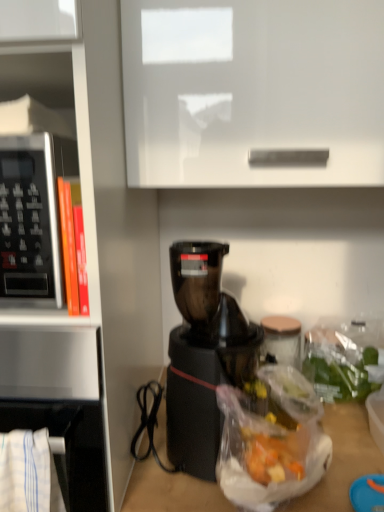
What do you see at coordinates (253, 93) in the screenshot?
I see `white glossy cabinet at upper center` at bounding box center [253, 93].

Describe the element at coordinates (339, 366) in the screenshot. I see `translucent plastic bag at lower right` at that location.

You are a GUI agent. You are given a task and a screenshot of the screen. Output one action in this format:
    pyautogui.click(x=<x>, y=<y>)
    Task: Click on the translucent plastic bag at lower right
    This screenshot has height=512, width=384.
    Given the screenshot: What is the action you would take?
    pyautogui.click(x=339, y=366)

Identify the location of black plastic microwave at left. This screenshot has width=384, height=512. (32, 216).

Locate an element on the screen. The width and height of the screenshot is (384, 512). white glossy cabinet at upper center is located at coordinates (253, 93).

Is black plastic microwave at left closer to the viewer compared to satin silver microwave at left?

No, black plastic microwave at left is behind satin silver microwave at left.

Does point (47, 226) come in front of point (45, 348)?

Yes, point (47, 226) is in front of point (45, 348).

Measure the distance from black plastic microwave at left to black plastic coffee maker at center.

They are 15.11 inches apart.

From the image's perspective, which one is positioned lower, black plastic microwave at left or black plastic coffee maker at center?

black plastic coffee maker at center appears lower in the image.

From a real-world perspective, between black plastic microwave at left and black plastic coffee maker at center, who is vertically higher?

black plastic microwave at left, from a real-world perspective.

Considering the sizes of black plastic microwave at left and black plastic coffee maker at center in the image, is black plastic microwave at left taller or shorter than black plastic coffee maker at center?

Considering their sizes, black plastic microwave at left has less height than black plastic coffee maker at center.

From a real-world perspective, is white glossy cabinet at upper center over translucent plastic bag at lower right?

Yes, from a real-world perspective, white glossy cabinet at upper center is over translucent plastic bag at lower right

Which of these two, white glossy cabinet at upper center or translucent plastic bag at lower right, is bigger?

With larger size is white glossy cabinet at upper center.

Is translucent plastic bag at lower right surrounded by white glossy cabinet at upper center?

No, white glossy cabinet at upper center does not contain translucent plastic bag at lower right.

Is white glossy cabinet at upper center oriented towards translucent plastic bag at lower right?

No, white glossy cabinet at upper center does not turn towards translucent plastic bag at lower right.

Considering the sizes of objects black plastic coffee maker at center and black plastic microwave at left in the image provided, who is taller, black plastic coffee maker at center or black plastic microwave at left?

With more height is black plastic coffee maker at center.

Choose the correct answer: Is black plastic coffee maker at center inside black plastic microwave at left or outside it?

black plastic coffee maker at center cannot be found inside black plastic microwave at left.

Is black plastic coffee maker at center turned away from black plastic microwave at left?

No.

Is black plastic coffee maker at center to the right of black plastic microwave at left from the viewer's perspective?

Yes.

How many degrees apart are the facing directions of translucent plastic bag at lower right and satin silver microwave at left?

translucent plastic bag at lower right and satin silver microwave at left are facing 1.12 degrees away from each other.

Between translucent plastic bag at lower right and satin silver microwave at left, which one is positioned behind?

translucent plastic bag at lower right is further away from the camera.

From a real-world perspective, relative to satin silver microwave at left, is translucent plastic bag at lower right vertically above or below?

translucent plastic bag at lower right is situated lower than satin silver microwave at left in the real world.

Choose the correct answer: Is translucent plastic bag at lower right inside satin silver microwave at left or outside it?

translucent plastic bag at lower right lies outside satin silver microwave at left.

Considering the positions of point (202, 365) and point (103, 252), is point (202, 365) closer or farther from the camera than point (103, 252)?

Point (202, 365) appears to be farther away from the viewer than point (103, 252).

Which object is positioned more to the right, black plastic coffee maker at center or satin silver microwave at left?

black plastic coffee maker at center.

Identify the location of bookshelf on the left of black plastic coffee maker at center. The height and width of the screenshot is (512, 384). (89, 269).

From a real-world perspective, relative to satin silver microwave at left, is black plastic coffee maker at center vertically above or below?

From a real-world perspective, black plastic coffee maker at center is physically below satin silver microwave at left.

Is the surface of black plastic microwave at left in direct contact with translucent plastic bag at lower right?

They are not placed beside each other.

Considering the relative sizes of black plastic microwave at left and translucent plastic bag at lower right in the image provided, is black plastic microwave at left shorter than translucent plastic bag at lower right?

No.

Is black plastic microwave at left bigger than translucent plastic bag at lower right?

Indeed, black plastic microwave at left has a larger size compared to translucent plastic bag at lower right.

Identify the location of microwave oven on the right of satin silver microwave at left. (32, 216).

At what (x,y) coordinates should I click in order to perform the action: click on coffee maker behind the black plastic microwave at left. Please return your answer as a coordinate pair (x, y). The image size is (384, 512). Looking at the image, I should click on (203, 355).

Estimate the real-world distances between objects in this image. Which object is further from black plastic microwave at left, black plastic coffee maker at center or satin silver microwave at left?

Based on the image, black plastic coffee maker at center appears to be further to black plastic microwave at left.

Based on their spatial positions, is translucent plastic bag at lower right or black plastic coffee maker at center closer to black plastic microwave at left?

The object closer to black plastic microwave at left is black plastic coffee maker at center.

Which object lies further to the anchor point satin silver microwave at left, black plastic coffee maker at center or black plastic microwave at left?

The object further to satin silver microwave at left is black plastic coffee maker at center.

Estimate the real-world distances between objects in this image. Which object is closer to white glossy cabinet at upper center, black plastic microwave at left or satin silver microwave at left?

Based on the image, satin silver microwave at left appears to be nearer to white glossy cabinet at upper center.

Which object lies nearer to the anchor point translucent plastic bag at lower right, white glossy cabinet at upper center or black plastic microwave at left?

Based on the image, white glossy cabinet at upper center appears to be nearer to translucent plastic bag at lower right.

Which object lies nearer to the anchor point translucent plastic bag at lower right, black plastic microwave at left or black plastic coffee maker at center?

black plastic coffee maker at center lies closer to translucent plastic bag at lower right than the other object.

From the image, which object appears to be nearer to black plastic coffee maker at center, translucent plastic bag at lower right or white glossy cabinet at upper center?

translucent plastic bag at lower right is positioned closer to the anchor black plastic coffee maker at center.

Based on their spatial positions, is satin silver microwave at left or white glossy cabinet at upper center further from black plastic coffee maker at center?

white glossy cabinet at upper center.

At what (x,y) coordinates should I click in order to perform the action: click on coffee maker between black plastic microwave at left and translucent plastic bag at lower right. Please return your answer as a coordinate pair (x, y). Image resolution: width=384 pixels, height=512 pixels. Looking at the image, I should click on (203, 355).

I want to click on cabinetry situated between satin silver microwave at left and translucent plastic bag at lower right from left to right, so click(x=253, y=93).

Locate an element on the screen. This screenshot has height=512, width=384. microwave oven between satin silver microwave at left and white glossy cabinet at upper center in the horizontal direction is located at coordinates (32, 216).

Find the location of `cabinetry between black plastic microwave at left and translucent plastic bag at lower right`. cabinetry between black plastic microwave at left and translucent plastic bag at lower right is located at coordinates (253, 93).